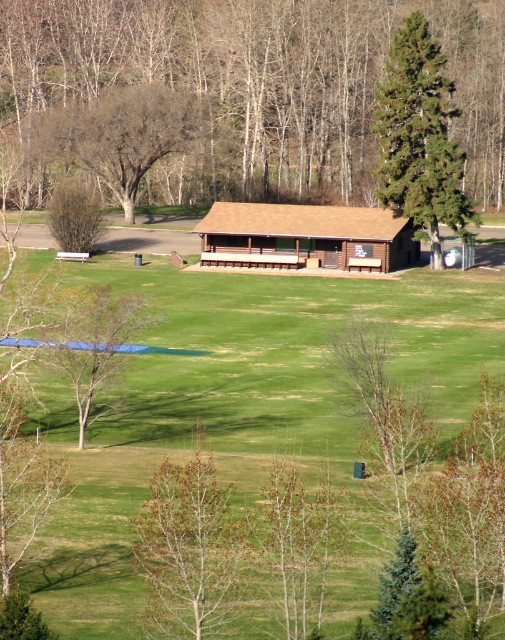
Which is in front, point (189, 552) or point (59, 192)?

Point (189, 552)

Is brown leafy tree at lower center above green leafy bush at left?

Incorrect, brown leafy tree at lower center is not positioned above green leafy bush at left.

Measure the distance between point (219, 612) and camera.

Point (219, 612) is 83.46 feet away from camera.

Identify the location of brown leafy tree at lower center. This screenshot has height=640, width=505. (190, 548).

Who is positioned more to the left, green leafy tree at center or green leafy bush at left?

green leafy bush at left is more to the left.

Does green leafy tree at center have a lesser height compared to green leafy bush at left?

No, green leafy tree at center is not shorter than green leafy bush at left.

Does point (317, 189) lie in front of point (53, 198)?

No, (317, 189) is further to viewer.

You are a GUI agent. You are given a task and a screenshot of the screen. Output one action in this format:
    pyautogui.click(x=<x>, y=<y>)
    Task: Click on the green leafy tree at center
    The height and width of the screenshot is (640, 505).
    Given the screenshot: What is the action you would take?
    pyautogui.click(x=260, y=84)

Who is positioned more to the left, brown wooden cabin at center or brown leafless tree at lower left?

From the viewer's perspective, brown leafless tree at lower left appears more on the left side.

Looking at this image, does brown wooden cabin at center have a lesser height compared to brown leafless tree at lower left?

Yes.

This screenshot has width=505, height=640. Describe the element at coordinates (306, 236) in the screenshot. I see `brown wooden cabin at center` at that location.

I want to click on brown wooden cabin at center, so click(306, 236).